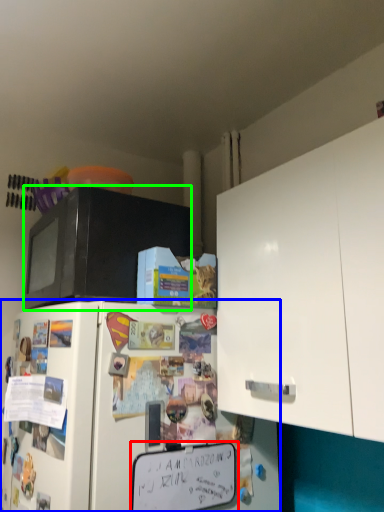
Question: Which object is the farthest from bulletin board (highlighted by a red box)? Choose among these: refrigerator (highlighted by a blue box) or microwave oven (highlighted by a green box).

Choices:
 (A) refrigerator
 (B) microwave oven

Answer: (B)